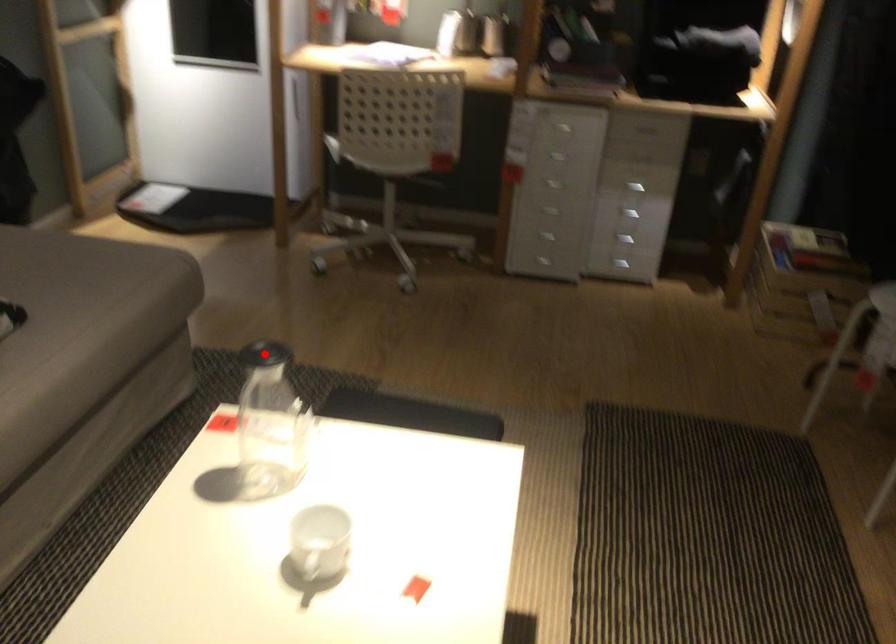
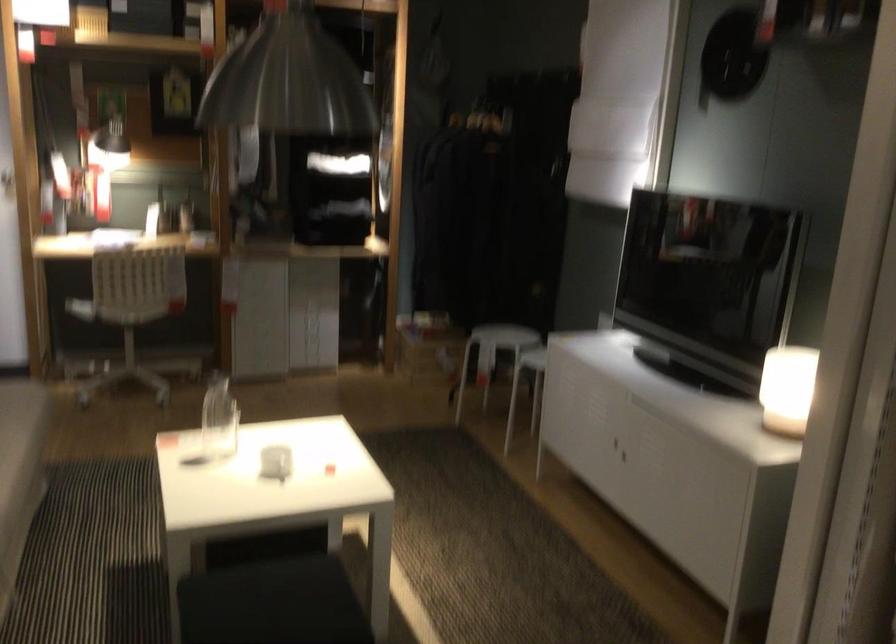
Locate, in the second image, the point that corresponds to the highlighted location in the first image.

(224, 383)